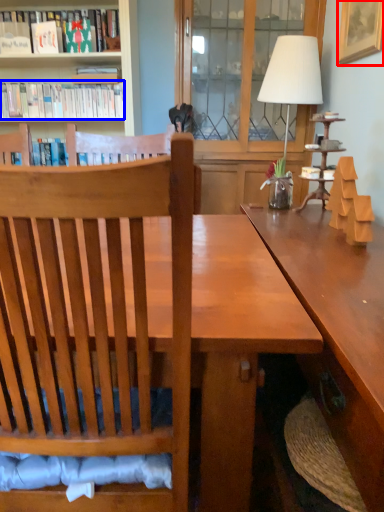
Question: Which object appears closest to the camera in this image, picture frame (highlighted by a red box) or book (highlighted by a blue box)?

Choices:
 (A) picture frame
 (B) book

Answer: (A)